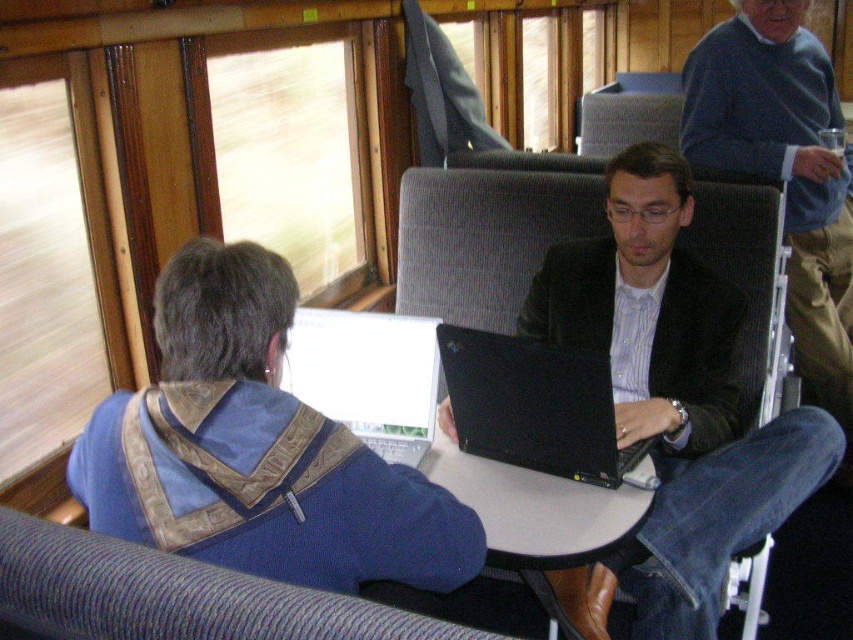
Can you confirm if blue corduroy coach at upper right is positioned to the left of black matte laptop at center?

No, blue corduroy coach at upper right is not to the left of black matte laptop at center.

Which of these two, blue corduroy coach at upper right or black matte laptop at center, stands shorter?

Standing shorter between the two is black matte laptop at center.

The height and width of the screenshot is (640, 853). What are the coordinates of `blue corduroy coach at upper right` in the screenshot? It's located at (782, 170).

The height and width of the screenshot is (640, 853). Find the location of `blue corduroy coach at upper right`. blue corduroy coach at upper right is located at coordinates (782, 170).

Is blue corduroy coach at upper right positioned in front of white plastic table at center?

No, it is behind white plastic table at center.

The image size is (853, 640). Identify the location of blue corduroy coach at upper right. (782, 170).

Can you confirm if matte black laptop at center is wider than white glossy laptop at center?

Yes, matte black laptop at center is wider than white glossy laptop at center.

Can you confirm if matte black laptop at center is positioned to the left of white glossy laptop at center?

No, matte black laptop at center is not to the left of white glossy laptop at center.

This screenshot has width=853, height=640. Describe the element at coordinates (676, 392) in the screenshot. I see `matte black laptop at center` at that location.

You are a GUI agent. You are given a task and a screenshot of the screen. Output one action in this format:
    pyautogui.click(x=<x>, y=<y>)
    Task: Click on the matte black laptop at center
    This screenshot has width=853, height=640.
    Given the screenshot: What is the action you would take?
    pyautogui.click(x=676, y=392)